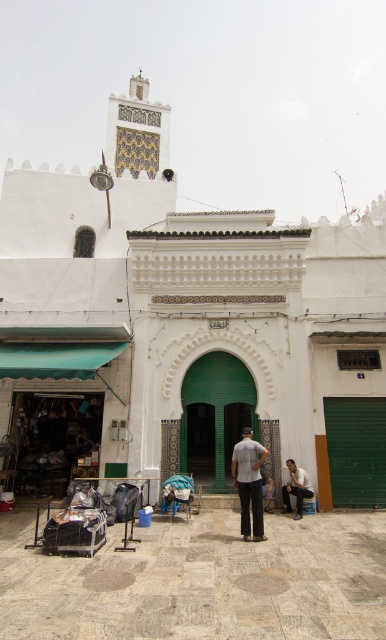
Question: Does white cotton shirt at lower right appear under light gray fabric pants at center?

Choices:
 (A) no
 (B) yes

Answer: (A)

Question: Which point appears farthest from the camera in this image?

Choices:
 (A) (255, 451)
 (B) (269, 477)
 (C) (23, 360)
 (D) (309, 493)

Answer: (B)

Question: Among these points, which one is nearest to the camera?

Choices:
 (A) (260, 464)
 (B) (116, 333)

Answer: (A)

Question: Is white textured wall at center wider than white cotton shirt at lower right?

Choices:
 (A) yes
 (B) no

Answer: (A)

Question: Does white textured wall at center lie in front of white cotton shirt at lower right?

Choices:
 (A) yes
 (B) no

Answer: (A)

Question: Which point is farther to the camera?

Choices:
 (A) light gray fabric pants at center
 (B) white textured wall at center
 (C) white cotton shirt at lower right
 (D) light gray cotton pants at center

Answer: (A)